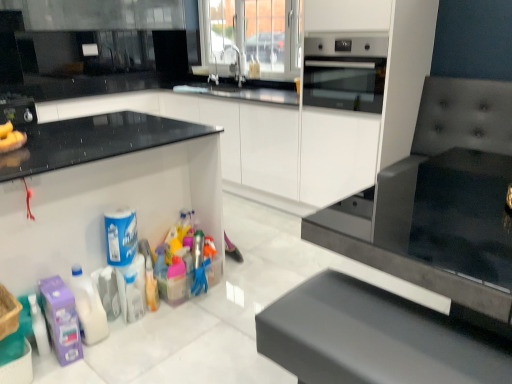
Find the location of a particular element. This screenshot has width=512, height=384. vacant region above purple matte cleaning product at lower left, which is the 4th cleaning product from right to left (from a real-world perspective) is located at coordinates tap(57, 288).